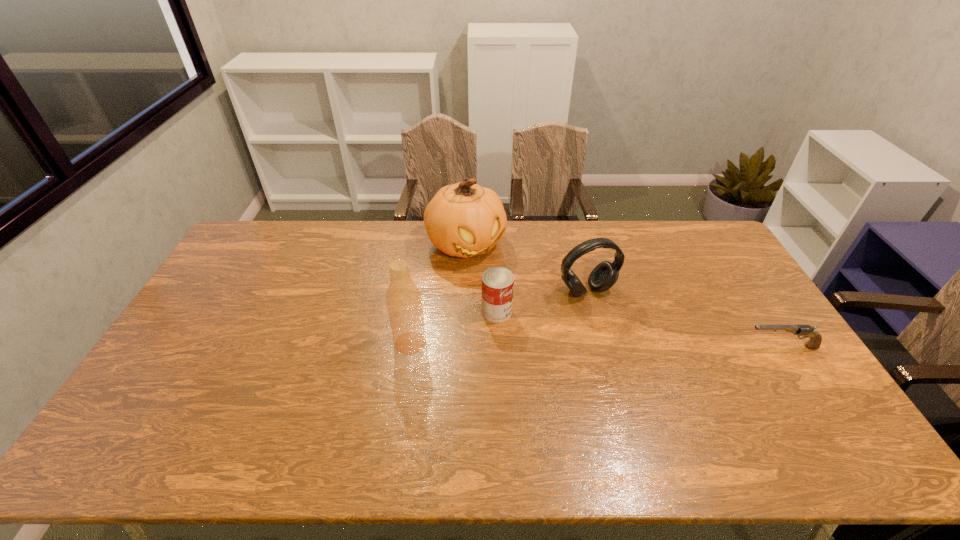
Identify the location of beer bottle. This screenshot has height=540, width=960. [403, 299].

The width and height of the screenshot is (960, 540). Find the location of `gun`. gun is located at coordinates (807, 331).

At what (x,y) coordinates should I click in order to perform the action: click on the shortest object. Please return your answer as a coordinate pair (x, y). The height and width of the screenshot is (540, 960). Looking at the image, I should click on (807, 331).

Locate an element on the screen. headset is located at coordinates (605, 274).

Where is `the third tallest object`? The height and width of the screenshot is (540, 960). the third tallest object is located at coordinates (605, 274).

The image size is (960, 540). I want to click on the farthest object, so 464,219.

The image size is (960, 540). In order to click on can in this screenshot , I will do `click(497, 282)`.

You are a GUI agent. You are given a task and a screenshot of the screen. Output one action in this format:
    pyautogui.click(x=<x>, y=<y>)
    Task: Click on the free space located 0.260m on the back of the beer bottle
    This screenshot has width=960, height=540.
    Given the screenshot: What is the action you would take?
    pyautogui.click(x=420, y=273)

Locate an element on the screen. vacant region located aiming along the barrel of the shortest object is located at coordinates (689, 347).

Where is `vacant space positioned 0.230m aiming along the barrel of the shortest object`? The width and height of the screenshot is (960, 540). vacant space positioned 0.230m aiming along the barrel of the shortest object is located at coordinates (665, 347).